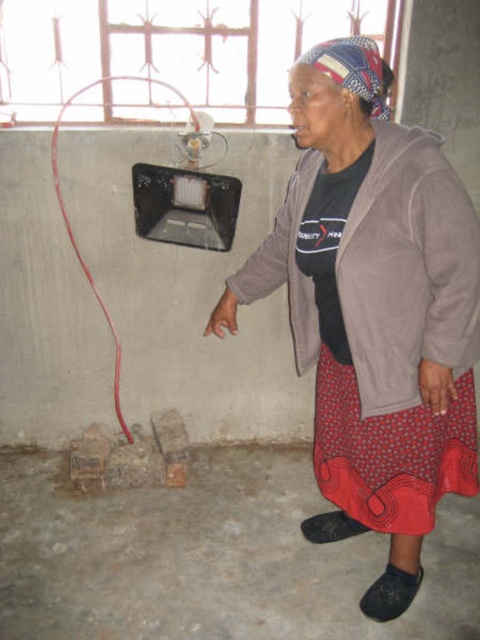
Question: Which object is farther from the camera taking this photo?

Choices:
 (A) matte gray jacket at center
 (B) red rubber wire at left

Answer: (B)

Question: Can you confirm if matte gray jacket at center is positioned to the right of red rubber wire at left?

Choices:
 (A) yes
 (B) no

Answer: (A)

Question: Can you confirm if matte gray jacket at center is positioned above red rubber wire at left?

Choices:
 (A) yes
 (B) no

Answer: (B)

Question: Which point is farther from the camera taking this photo?

Choices:
 (A) (327, 177)
 (B) (116, 356)

Answer: (B)

Question: Is matte gray jacket at center below red rubber wire at left?

Choices:
 (A) yes
 (B) no

Answer: (A)